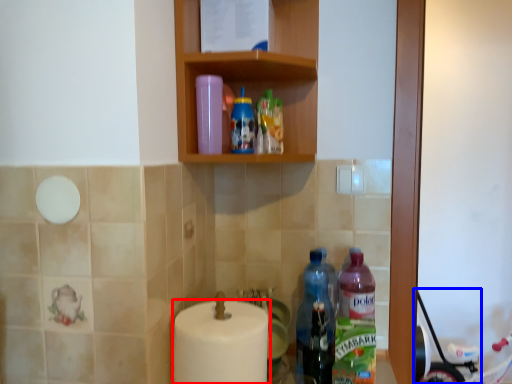
Question: Which point is closer to the camera, toilet paper (highlighted by a red box) or baby carriage (highlighted by a blue box)?

Choices:
 (A) toilet paper
 (B) baby carriage

Answer: (A)